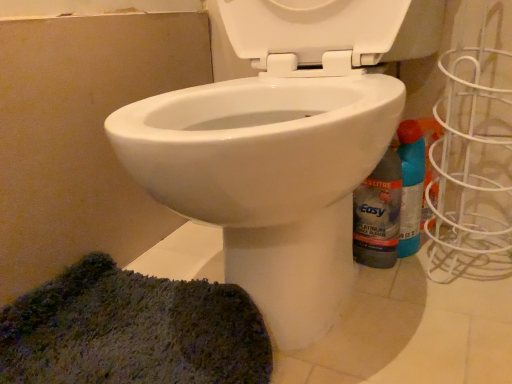
You are a GUI agent. You are given a task and a screenshot of the screen. Output one action in this format:
    pyautogui.click(x=<x>, y=<y>)
    Task: Click on the blue plastic spray bottle at right
    This screenshot has width=512, height=384.
    Given the screenshot: What is the action you would take?
    pyautogui.click(x=411, y=185)

This screenshot has height=384, width=512. I want to click on blue plastic spray bottle at right, so click(x=411, y=185).

Is translucent plastic bottle at lower right a part of green textured rug at lower left?

No, translucent plastic bottle at lower right is not a part of green textured rug at lower left.

Which object is further away from the camera taking this photo, green textured rug at lower left or translucent plastic bottle at lower right?

translucent plastic bottle at lower right.

Looking at their sizes, would you say green textured rug at lower left is wider or thinner than translucent plastic bottle at lower right?

In the image, green textured rug at lower left appears to be wider than translucent plastic bottle at lower right.

From the image's perspective, between green textured rug at lower left and translucent plastic bottle at lower right, which one is located above?

translucent plastic bottle at lower right appears higher in the image.

From the image's perspective, who appears lower, translucent plastic bottle at lower right or green textured rug at lower left?

green textured rug at lower left appears lower in the image.

Looking at the image, does translucent plastic bottle at lower right seem bigger or smaller compared to green textured rug at lower left?

translucent plastic bottle at lower right is smaller than green textured rug at lower left.

From a real-world perspective, which object rests below the other?

From a 3D spatial view, green textured rug at lower left is below.

Does point (361, 216) come closer to viewer compared to point (37, 311)?

No, (361, 216) is behind (37, 311).

Which of these two, green textured rug at lower left or blue plastic spray bottle at right, is smaller?

Smaller between the two is blue plastic spray bottle at right.

Is there a large distance between green textured rug at lower left and blue plastic spray bottle at right?

green textured rug at lower left is actually quite close to blue plastic spray bottle at right.

Is green textured rug at lower left thinner than blue plastic spray bottle at right?

No, green textured rug at lower left is not thinner than blue plastic spray bottle at right.

Is point (143, 283) behind point (421, 141)?

That is True.

From a real-world perspective, is translucent plastic bottle at lower right below blue plastic spray bottle at right?

No, from a real-world perspective, translucent plastic bottle at lower right is not beneath blue plastic spray bottle at right.

Where is `bottle below the blue plastic spray bottle at right (from the image's perspective)`? Image resolution: width=512 pixels, height=384 pixels. bottle below the blue plastic spray bottle at right (from the image's perspective) is located at coordinates (378, 214).

Looking at this image, from the image's perspective, which is above, translucent plastic bottle at lower right or blue plastic spray bottle at right?

blue plastic spray bottle at right, from the image's perspective.

Are translucent plastic bottle at lower right and blue plastic spray bottle at right far apart?

translucent plastic bottle at lower right is actually quite close to blue plastic spray bottle at right.

Which object is closer to the camera, blue plastic spray bottle at right or green textured rug at lower left?

Positioned in front is green textured rug at lower left.

Is blue plastic spray bottle at right facing away from green textured rug at lower left?

blue plastic spray bottle at right is not turned away from green textured rug at lower left.

Considering the relative sizes of blue plastic spray bottle at right and green textured rug at lower left in the image provided, is blue plastic spray bottle at right taller than green textured rug at lower left?

Correct, blue plastic spray bottle at right is much taller as green textured rug at lower left.

The image size is (512, 384). Identify the location of doormat in front of the blue plastic spray bottle at right. coord(132,331).

Considering the sizes of blue plastic spray bottle at right and translucent plastic bottle at lower right in the image, is blue plastic spray bottle at right wider or thinner than translucent plastic bottle at lower right?

Considering their sizes, blue plastic spray bottle at right looks broader than translucent plastic bottle at lower right.

Is blue plastic spray bottle at right bigger than translucent plastic bottle at lower right?

Yes.

Is blue plastic spray bottle at right positioned far away from translucent plastic bottle at lower right?

No.

The width and height of the screenshot is (512, 384). I want to click on doormat lying on the left of translucent plastic bottle at lower right, so click(x=132, y=331).

The image size is (512, 384). What are the coordinates of `bottle above the green textured rug at lower left (from the image's perspective)` in the screenshot? It's located at (378, 214).

Based on their spatial positions, is translucent plastic bottle at lower right or green textured rug at lower left closer to blue plastic spray bottle at right?

translucent plastic bottle at lower right is positioned closer to the anchor blue plastic spray bottle at right.

Which object lies nearer to the anchor point translucent plastic bottle at lower right, green textured rug at lower left or blue plastic spray bottle at right?

blue plastic spray bottle at right lies closer to translucent plastic bottle at lower right than the other object.

In the scene shown: Which object lies nearer to the anchor point green textured rug at lower left, translucent plastic bottle at lower right or blue plastic spray bottle at right?

translucent plastic bottle at lower right is closer to green textured rug at lower left.

From the image, which object appears to be farther from blue plastic spray bottle at right, green textured rug at lower left or translucent plastic bottle at lower right?

green textured rug at lower left is positioned further to the anchor blue plastic spray bottle at right.

When comparing their distances from green textured rug at lower left, does blue plastic spray bottle at right or translucent plastic bottle at lower right seem further?

blue plastic spray bottle at right is further to green textured rug at lower left.

Considering their positions, is blue plastic spray bottle at right positioned closer to translucent plastic bottle at lower right than green textured rug at lower left?

The object closer to translucent plastic bottle at lower right is blue plastic spray bottle at right.

Find the location of a particular element. The image size is (512, 384). bottle located between green textured rug at lower left and blue plastic spray bottle at right in the left-right direction is located at coordinates (378, 214).